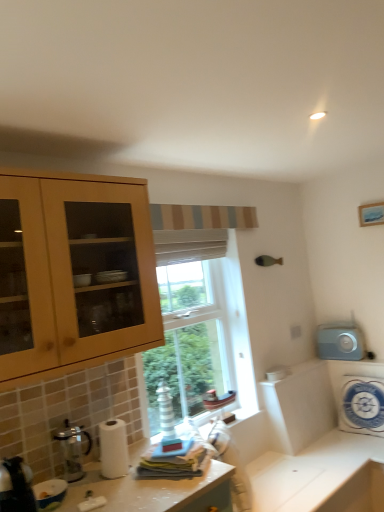
Question: Should I look upward or downward to see gray matte clock at right, arranged as the 2th appliance when viewed from the right?

Choices:
 (A) down
 (B) up

Answer: (A)

Question: From the image's perspective, is white glossy countertop at lower center over white glossy countertop at lower center?

Choices:
 (A) no
 (B) yes

Answer: (A)

Question: From the image's perspective, is white glossy countertop at lower center located beneath white glossy countertop at lower center?

Choices:
 (A) no
 (B) yes

Answer: (B)

Question: From a real-world perspective, is white glossy countertop at lower center located higher than white glossy countertop at lower center?

Choices:
 (A) no
 (B) yes

Answer: (A)

Question: Considering the relative positions of white glossy countertop at lower center and white glossy countertop at lower center in the image provided, is white glossy countertop at lower center to the left of white glossy countertop at lower center from the viewer's perspective?

Choices:
 (A) yes
 (B) no

Answer: (B)

Question: Is white glossy countertop at lower center beside white glossy countertop at lower center?

Choices:
 (A) no
 (B) yes

Answer: (A)

Question: Is white glossy countertop at lower center facing towards white glossy countertop at lower center?

Choices:
 (A) yes
 (B) no

Answer: (B)

Question: Is white glossy bowl at lower left, the third appliance in the back-to-front sequence, surrounding gray matte clock at right, arranged as the third appliance when viewed from the left?

Choices:
 (A) yes
 (B) no

Answer: (B)

Question: Can you confirm if white glossy bowl at lower left, the third appliance in the back-to-front sequence, is positioned to the left of gray matte clock at right, arranged as the 2th appliance when viewed from the right?

Choices:
 (A) no
 (B) yes

Answer: (B)

Question: Is white glossy bowl at lower left, which is counted as the second appliance, starting from the front, aimed at gray matte clock at right, which ranks as the 1th appliance in back-to-front order?

Choices:
 (A) yes
 (B) no

Answer: (B)

Question: Does white glossy bowl at lower left, the 2th appliance from the left, have a larger size compared to gray matte clock at right, which ranks as the 1th appliance in back-to-front order?

Choices:
 (A) yes
 (B) no

Answer: (B)

Question: Considering the relative sizes of white glossy bowl at lower left, which is counted as the second appliance, starting from the front, and gray matte clock at right, arranged as the 2th appliance when viewed from the right, in the image provided, is white glossy bowl at lower left, which is counted as the second appliance, starting from the front, smaller than gray matte clock at right, arranged as the 2th appliance when viewed from the right,?

Choices:
 (A) yes
 (B) no

Answer: (A)

Question: Can you confirm if white glossy bowl at lower left, the third appliance in the back-to-front sequence, is positioned to the right of gray matte clock at right, arranged as the third appliance when viewed from the left?

Choices:
 (A) yes
 (B) no

Answer: (B)

Question: From a real-world perspective, is metallic silver kettle at lower left, which ranks as the 4th appliance in back-to-front order, below gray matte clock at right, arranged as the 4th appliance when viewed from the front?

Choices:
 (A) no
 (B) yes

Answer: (B)